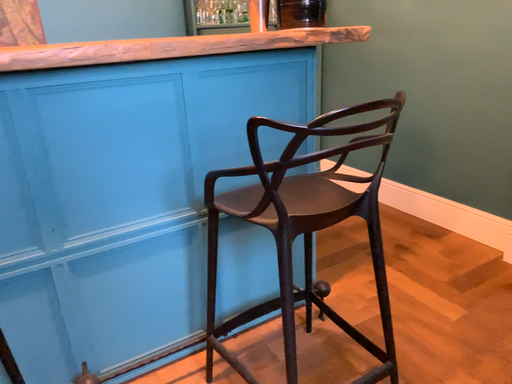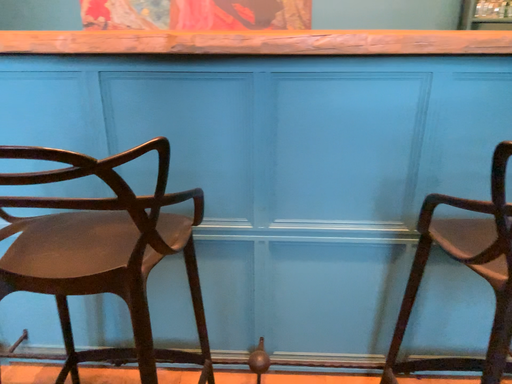
Question: How did the camera likely rotate when shooting the video?

Choices:
 (A) rotated left
 (B) rotated right

Answer: (A)